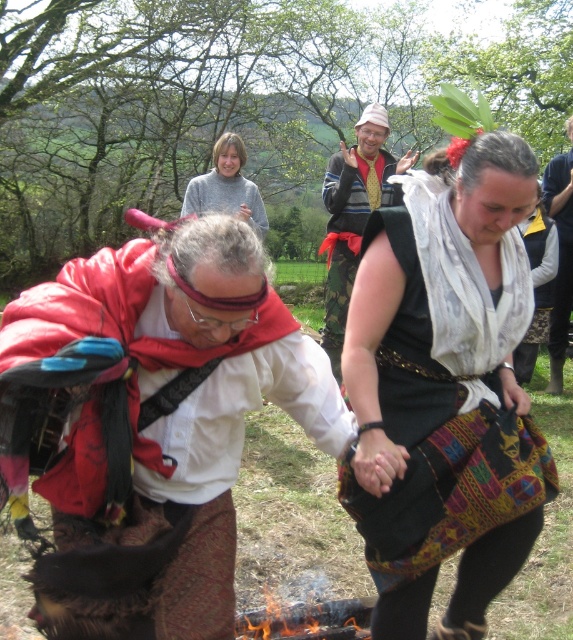
You are a photographer trying to capture the two points in the scene. Which point, point (359, 307) or point (332, 209), is closer to your camera lens?

Point (359, 307) is closer to the camera lens than point (332, 209).

You are organizing a small campfire gathering and have both the black woven fabric bag at center and the charcoal wood fire at lower center in your view. Which object would require more space to store or move?

The black woven fabric bag at center is bigger than the charcoal wood fire at lower center, so it would require more space to store or move.

You are an event photographer at the cultural reenactment. You need to capture a photo where the matte red cape at center and the velvet yellow vest at center are both clearly visible. Based on their positions, which one should you ensure is in the foreground to avoid it being blocked?

The matte red cape at center is located below the velvet yellow vest at center, so to avoid blocking, ensure the velvet yellow vest at center is in the foreground.